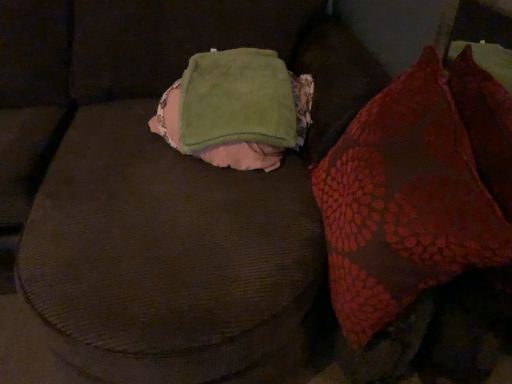
Question: Is green soft blanket at center at the back of velvet red pillow at right?

Choices:
 (A) no
 (B) yes

Answer: (A)

Question: Does velvet red pillow at right have a greater height compared to green soft blanket at center?

Choices:
 (A) no
 (B) yes

Answer: (B)

Question: From a real-world perspective, is velvet red pillow at right positioned over green soft blanket at center based on gravity?

Choices:
 (A) yes
 (B) no

Answer: (B)

Question: From the image's perspective, is velvet red pillow at right located beneath green soft blanket at center?

Choices:
 (A) yes
 (B) no

Answer: (A)

Question: Is green soft blanket at center surrounded by velvet red pillow at right?

Choices:
 (A) no
 (B) yes

Answer: (A)

Question: From the image's perspective, is velvet red pillow at right above green soft blanket at center?

Choices:
 (A) no
 (B) yes

Answer: (A)

Question: Is green soft blanket at center behind velvet red pillow at right?

Choices:
 (A) yes
 (B) no

Answer: (A)

Question: Considering the relative sizes of green soft blanket at center and velvet red pillow at right in the image provided, is green soft blanket at center taller than velvet red pillow at right?

Choices:
 (A) no
 (B) yes

Answer: (A)

Question: From a real-world perspective, is green soft blanket at center located beneath velvet red pillow at right?

Choices:
 (A) no
 (B) yes

Answer: (A)

Question: Is green soft blanket at center at the left side of velvet red pillow at right?

Choices:
 (A) yes
 (B) no

Answer: (A)

Question: Is green soft blanket at center beside velvet red pillow at right?

Choices:
 (A) yes
 (B) no

Answer: (B)

Question: Is green soft blanket at center looking in the opposite direction of velvet red pillow at right?

Choices:
 (A) yes
 (B) no

Answer: (B)

Question: Considering the positions of velvet red pillow at right and green soft blanket at center in the image, is velvet red pillow at right bigger or smaller than green soft blanket at center?

Choices:
 (A) small
 (B) big

Answer: (B)